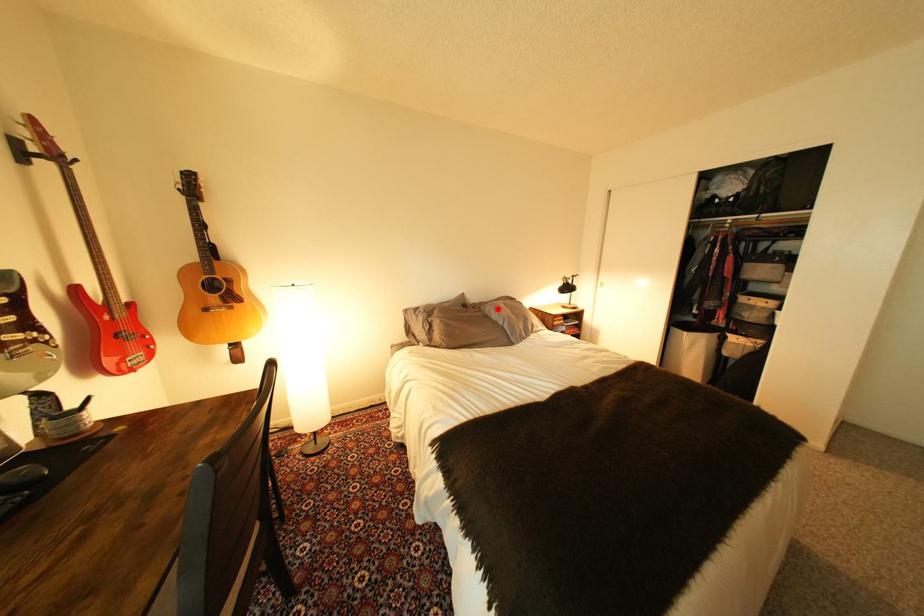
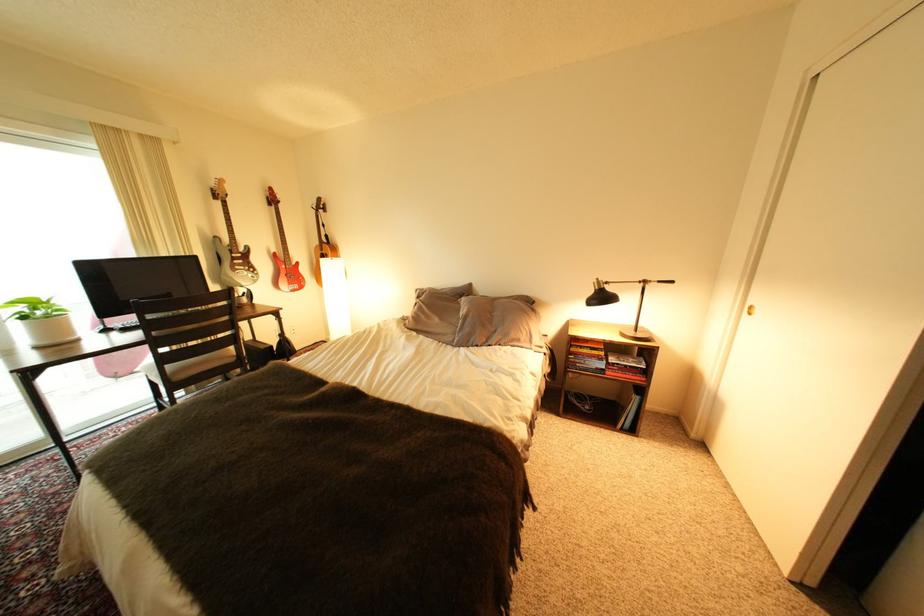
The point at the highlighted location is marked in the first image. Where is the corresponding point in the second image?

(473, 302)